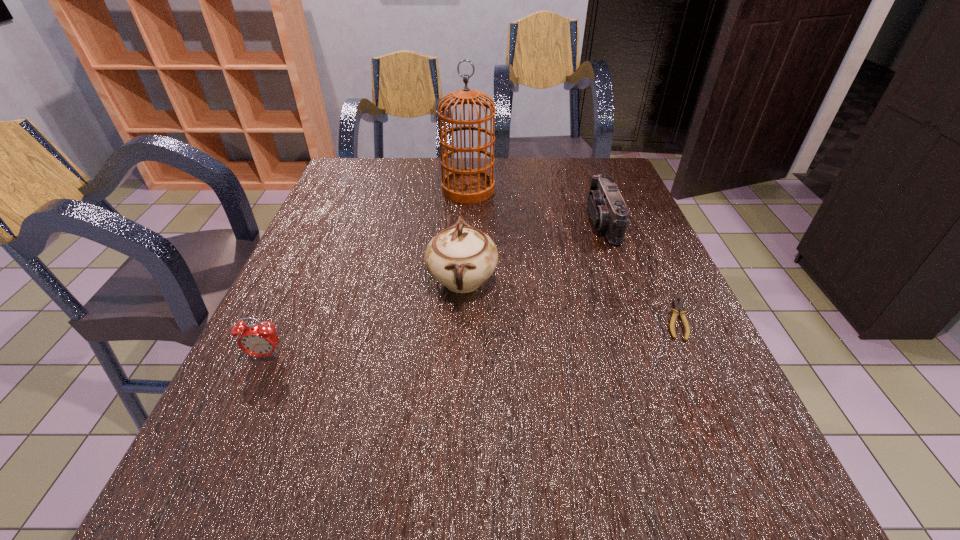
Image resolution: width=960 pixels, height=540 pixels. Find the location of `vacant space that is in between the shortest object and the camcorder`. vacant space that is in between the shortest object and the camcorder is located at coordinates (639, 271).

The height and width of the screenshot is (540, 960). Find the location of `vacant space in between the fourth object from left to right and the birdcage`. vacant space in between the fourth object from left to right and the birdcage is located at coordinates (536, 206).

Locate an element on the screen. free area in between the fourth shortest object and the fourth object from left to right is located at coordinates (533, 252).

Select which object appears as the second closest to the birdcage. Please provide its 2D coordinates. Your answer should be formatted as a tuple, i.e. [(x, y)], where the tuple contains the x and y coordinates of a point satisfying the conditions above.

[(608, 211)]

Locate which object ranks third in proximity to the nearest object. Please provide its 2D coordinates. Your answer should be formatted as a tuple, i.e. [(x, y)], where the tuple contains the x and y coordinates of a point satisfying the conditions above.

[(608, 211)]

Find the location of a particular element. The image size is (960, 540). vacant point that satisfies the following two spatial constraints: 1. on the front side of the rightmost object; 2. on the right side of the tallest object is located at coordinates (463, 319).

The width and height of the screenshot is (960, 540). Find the location of `free location that satisfies the following two spatial constraints: 1. on the front-facing side of the camcorder; 2. on the left side of the shortest object`. free location that satisfies the following two spatial constraints: 1. on the front-facing side of the camcorder; 2. on the left side of the shortest object is located at coordinates (638, 319).

Where is `free space that satisfies the following two spatial constraints: 1. on the front-facing side of the rightmost object; 2. on the left side of the camcorder`? The image size is (960, 540). free space that satisfies the following two spatial constraints: 1. on the front-facing side of the rightmost object; 2. on the left side of the camcorder is located at coordinates (638, 319).

Image resolution: width=960 pixels, height=540 pixels. I want to click on free space in the image that satisfies the following two spatial constraints: 1. on the front side of the pliers; 2. on the right side of the fourth shortest object, so click(x=461, y=319).